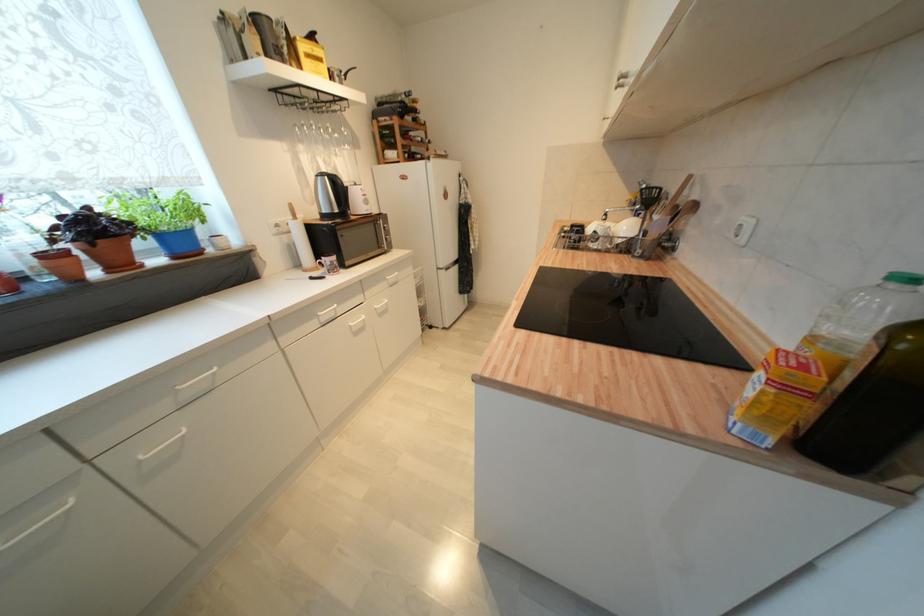
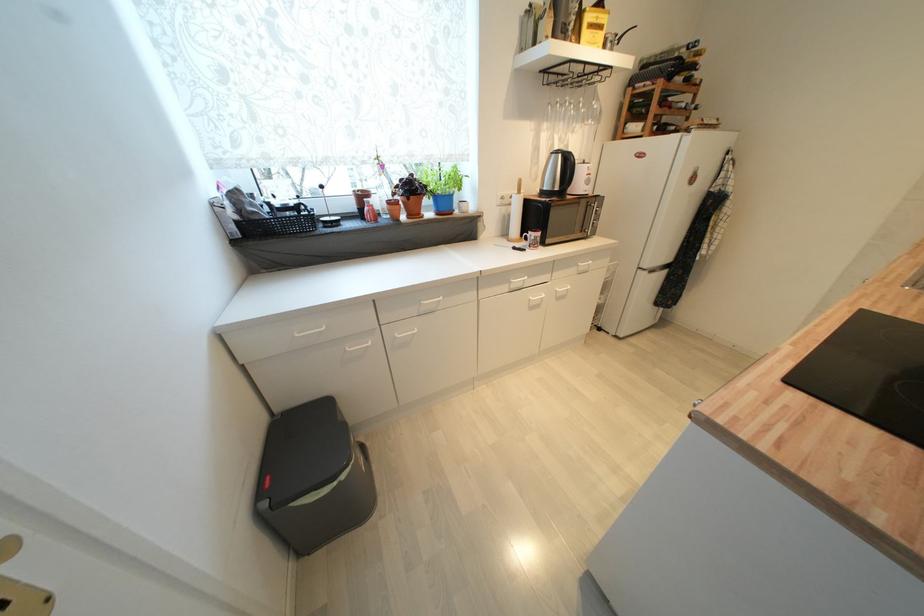
Where in the second image is the point corresponding to the point at 432,156 from the first image?

(690, 127)